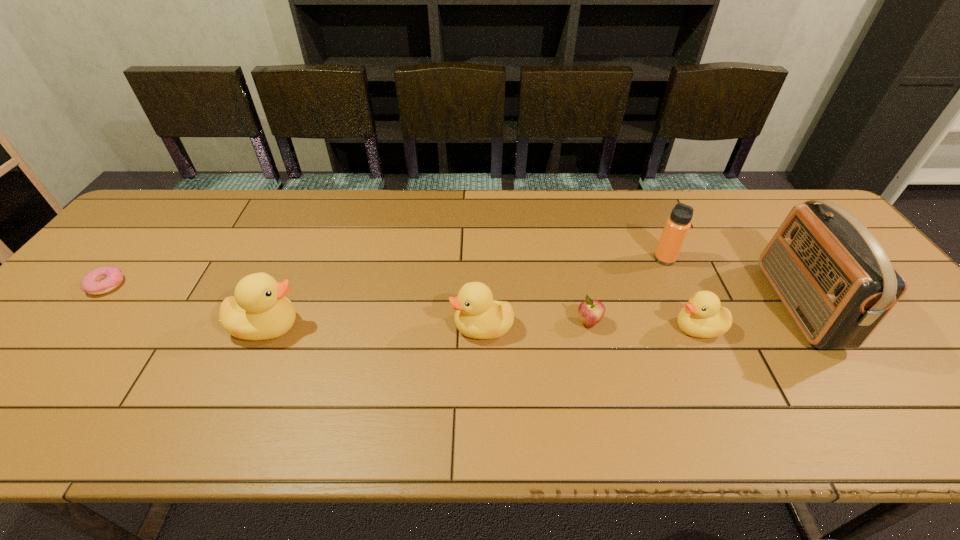
Identify which object is located as the nearest to the radio receiver. Please provide its 2D coordinates. Your answer should be formatted as a tuple, i.e. [(x, y)], where the tuple contains the x and y coordinates of a point satisfying the conditions above.

[(702, 317)]

Locate an element on the screen. This screenshot has height=540, width=960. the third closest duckling to the doughnut is located at coordinates (702, 317).

Where is `duckling that is the closest to the thermos bottle`? duckling that is the closest to the thermos bottle is located at coordinates (702, 317).